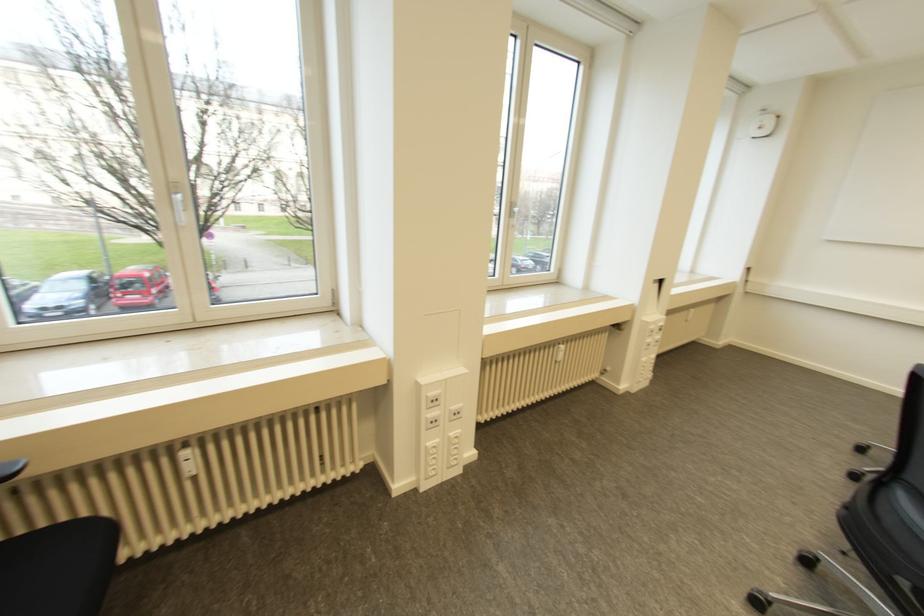
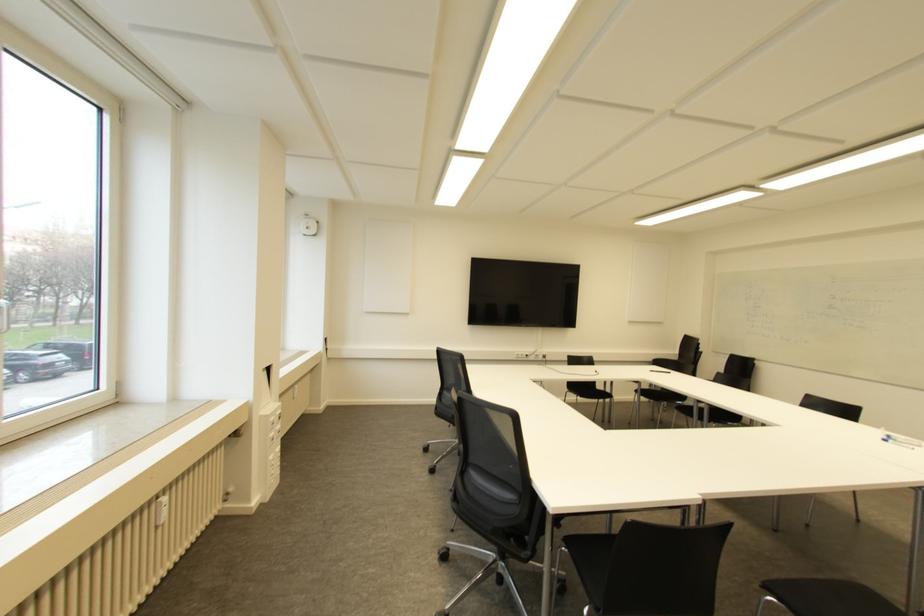
The point at (561, 346) is marked in the first image. Where is the corresponding point in the second image?

(163, 499)